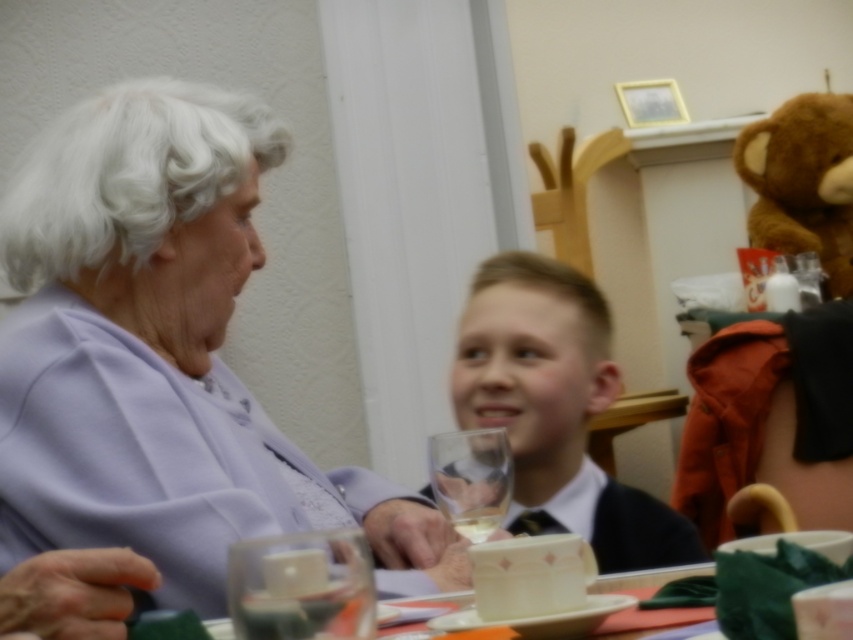
Question: Does matte black tie at center appear on the left side of transparent glass at lower center?

Choices:
 (A) yes
 (B) no

Answer: (B)

Question: Can you confirm if brown plush teddy bear at upper right is wider than transparent glass at lower center?

Choices:
 (A) no
 (B) yes

Answer: (B)

Question: Which object is the closest to the brown plush teddy bear at upper right?

Choices:
 (A) clear glass wine glass at lower center
 (B) clear glass wine at lower center

Answer: (A)

Question: Which point appears farthest from the camera in this image?

Choices:
 (A) (480, 497)
 (B) (103, 628)
 (C) (294, 625)

Answer: (A)

Question: Among these objects, which one is nearest to the camera?

Choices:
 (A) transparent glass at lower center
 (B) matte black tie at center
 (C) clear glass wine at lower center
 (D) clear glass wine glass at lower center

Answer: (A)

Question: Can you confirm if matte black tie at center is bigger than clear glass wine glass at lower center?

Choices:
 (A) yes
 (B) no

Answer: (A)